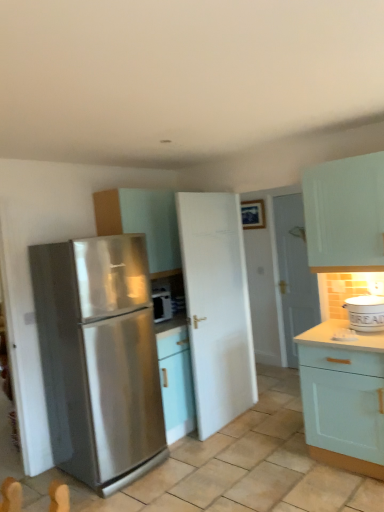
You are a GUI agent. You are given a task and a screenshot of the screen. Output one action in this format:
    pyautogui.click(x=<x>, y=<y>)
    Task: Click on the vacant area to the left of white ceramic bucket at right, which is counted as the 2th appliance, starting from the left
    This screenshot has width=384, height=512.
    Given the screenshot: What is the action you would take?
    pyautogui.click(x=333, y=332)